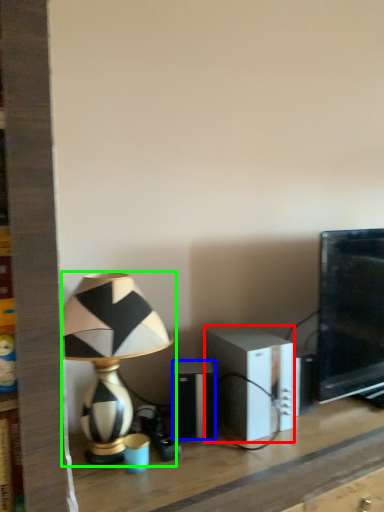
Question: Estimate the real-world distances between objects in this image. Which object is farther from speaker (highlighted by a red box), speaker (highlighted by a blue box) or lamp (highlighted by a green box)?

Choices:
 (A) speaker
 (B) lamp

Answer: (B)